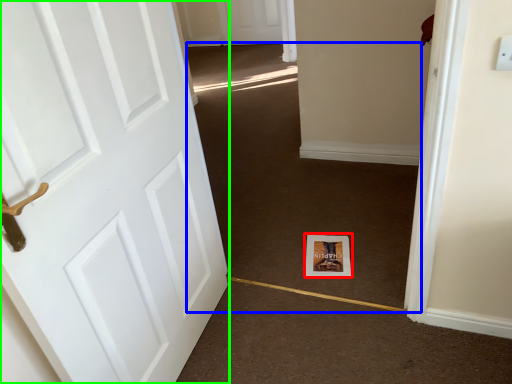
Question: Based on their relative distances, which object is nearer to print (highlighted by a red box)? Choose from plain (highlighted by a blue box) and door (highlighted by a green box).

Choices:
 (A) plain
 (B) door

Answer: (A)